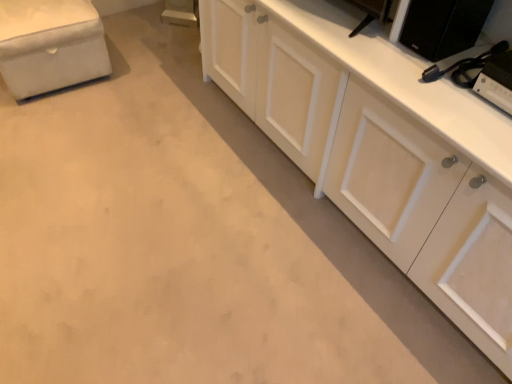
Question: Is black plastic game console at upper right, arranged as the 1th appliance when ordered from the bottom, not close to white wood cabinet at right?

Choices:
 (A) yes
 (B) no

Answer: (B)

Question: From the image's perspective, is black plastic game console at upper right, arranged as the 1th appliance when ordered from the bottom, under white wood cabinet at right?

Choices:
 (A) yes
 (B) no

Answer: (A)

Question: Is black plastic game console at upper right, the second appliance positioned from the top, positioned in front of white wood cabinet at right?

Choices:
 (A) no
 (B) yes

Answer: (A)

Question: Does black plastic game console at upper right, the second appliance positioned from the top, have a larger size compared to white wood cabinet at right?

Choices:
 (A) no
 (B) yes

Answer: (A)

Question: Is the surface of black plastic game console at upper right, the second appliance positioned from the top, in direct contact with white wood cabinet at right?

Choices:
 (A) yes
 (B) no

Answer: (B)

Question: From a real-world perspective, is black plastic game console at upper right, arranged as the 1th appliance when ordered from the bottom, above or below white wood cabinet at right?

Choices:
 (A) above
 (B) below

Answer: (A)

Question: Considering the positions of point (489, 82) and point (338, 82), is point (489, 82) closer or farther from the camera than point (338, 82)?

Choices:
 (A) farther
 (B) closer

Answer: (B)

Question: Do you think black plastic game console at upper right, the second appliance positioned from the top, is within white wood cabinet at right, or outside of it?

Choices:
 (A) inside
 (B) outside

Answer: (A)

Question: In the image, is black plastic game console at upper right, the second appliance positioned from the top, on the left side or the right side of white wood cabinet at right?

Choices:
 (A) right
 (B) left

Answer: (A)

Question: From a real-world perspective, relative to white wood cabinet at right, is black matte speaker at upper right, acting as the first appliance starting from the top, vertically above or below?

Choices:
 (A) above
 (B) below

Answer: (A)

Question: Is black matte speaker at upper right, acting as the first appliance starting from the top, spatially inside white wood cabinet at right, or outside of it?

Choices:
 (A) outside
 (B) inside

Answer: (B)

Question: Does point (443, 54) appear closer or farther from the camera than point (412, 223)?

Choices:
 (A) closer
 (B) farther

Answer: (A)

Question: Considering the positions of black matte speaker at upper right, acting as the first appliance starting from the top, and white wood cabinet at right in the image, is black matte speaker at upper right, acting as the first appliance starting from the top, bigger or smaller than white wood cabinet at right?

Choices:
 (A) big
 (B) small

Answer: (B)

Question: Does point (311, 140) appear closer or farther from the camera than point (431, 21)?

Choices:
 (A) closer
 (B) farther

Answer: (B)

Question: Is white wood cabinet at right wider or thinner than black matte speaker at upper right, acting as the first appliance starting from the top?

Choices:
 (A) thin
 (B) wide

Answer: (B)